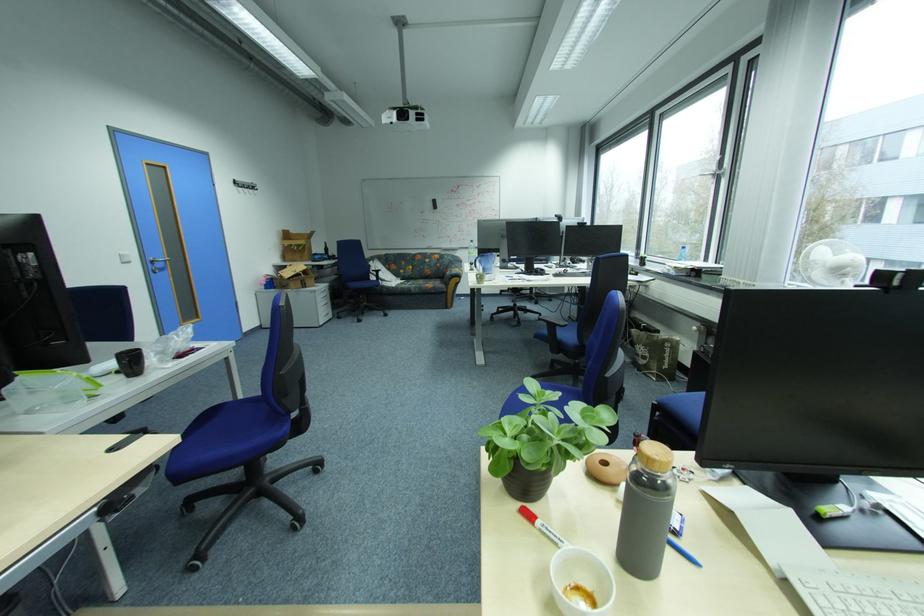
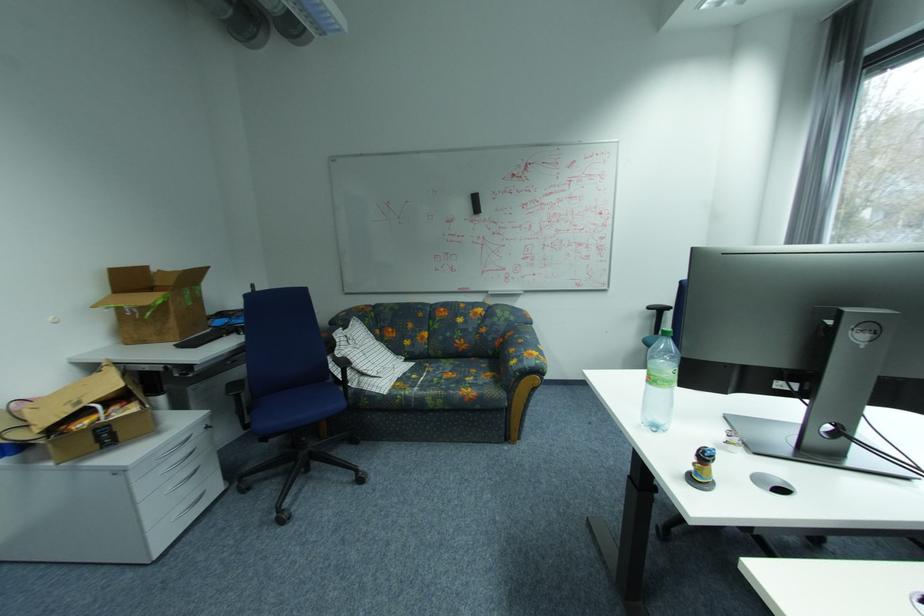
The point at (411, 286) is marked in the first image. Where is the corresponding point in the second image?

(416, 392)